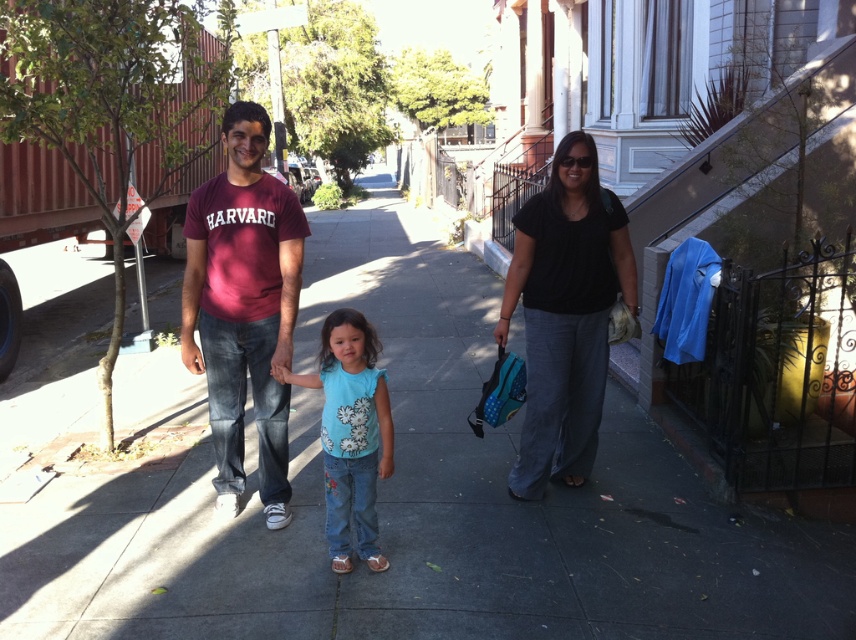
Question: Does maroon cotton t-shirt at center appear on the left side of black matte shirt at center?

Choices:
 (A) no
 (B) yes

Answer: (B)

Question: In this image, where is maroon cotton t-shirt at center located relative to light blue denim jeans at center?

Choices:
 (A) left
 (B) right

Answer: (A)

Question: Which of the following is the closest to the observer?

Choices:
 (A) (343, 467)
 (B) (114, 582)

Answer: (A)

Question: Which object appears closest to the camera in this image?

Choices:
 (A) light blue denim jeans at center
 (B) maroon cotton t-shirt at center

Answer: (A)

Question: Is gray concrete sidewalk at center thinner than light blue denim jeans at center?

Choices:
 (A) no
 (B) yes

Answer: (A)

Question: Which point is farther from the camera taking this photo?

Choices:
 (A) (379, 552)
 (B) (551, 449)
 (C) (251, 209)

Answer: (B)